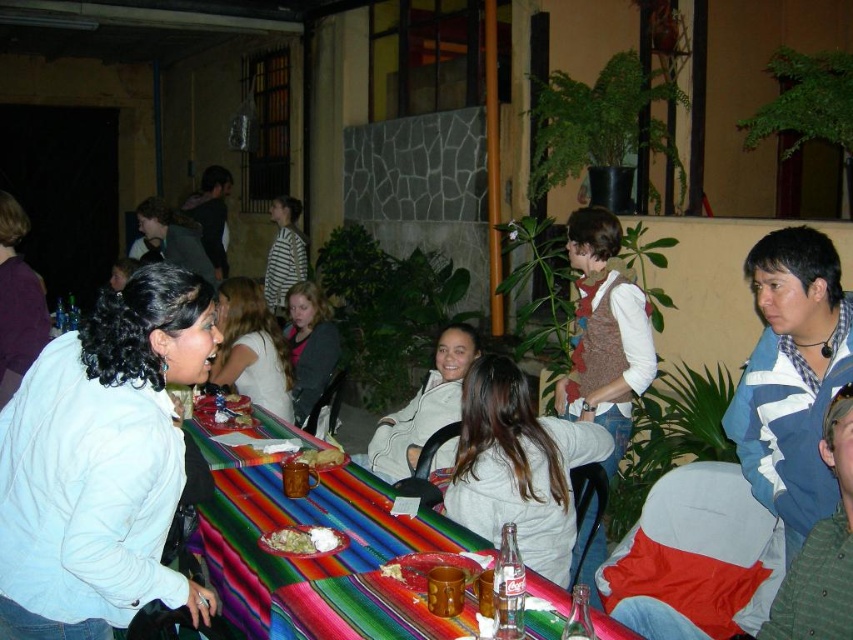
Question: Which point appears farthest from the camera in this image?

Choices:
 (A) (318, 451)
 (B) (302, 544)
 (C) (276, 516)

Answer: (A)

Question: Does multicolored woven tablecloth at center appear on the right side of smooth brown bread at center?

Choices:
 (A) yes
 (B) no

Answer: (A)

Question: Can you confirm if multicolored woven tablecloth at center is positioned below smooth brown bread at center?

Choices:
 (A) no
 (B) yes

Answer: (B)

Question: Which object appears farthest from the camera in this image?

Choices:
 (A) white rice at table center
 (B) multicolored woven tablecloth at center
 (C) smooth brown bread at center

Answer: (C)

Question: From the image, what is the correct spatial relationship of multicolored woven tablecloth at center in relation to smooth brown bread at center?

Choices:
 (A) above
 (B) below

Answer: (B)

Question: Which of the following is the closest to the observer?

Choices:
 (A) (312, 525)
 (B) (363, 476)

Answer: (A)